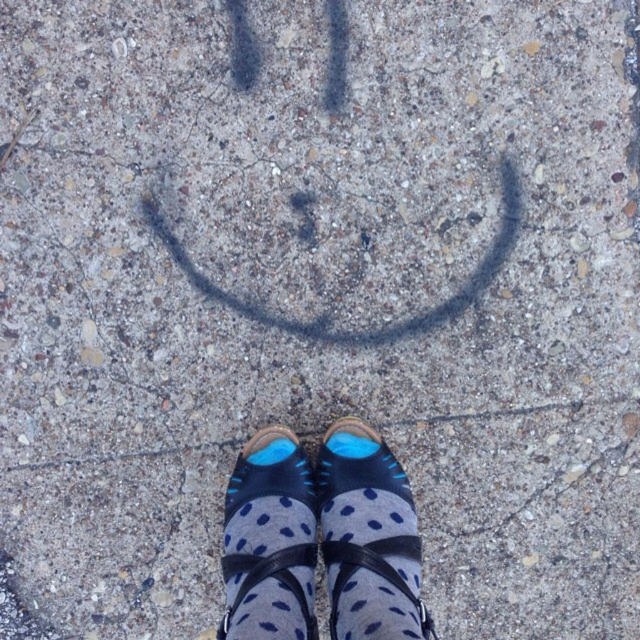
Can you confirm if blue fabric socks at center is taller than blue suede shoe at center?

Correct, blue fabric socks at center is much taller as blue suede shoe at center.

Between point (400, 552) and point (285, 481), which one is positioned behind?

The point (285, 481) is behind.

You are a GUI agent. You are given a task and a screenshot of the screen. Output one action in this format:
    pyautogui.click(x=<x>, y=<y>)
    Task: Click on the blue fabric socks at center
    The image size is (640, 640).
    Given the screenshot: What is the action you would take?
    coord(369,538)

The width and height of the screenshot is (640, 640). Identify the location of blue fabric socks at center. (369, 538).